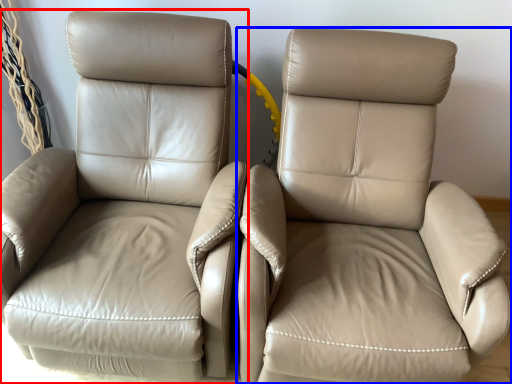
Question: Which point is further to the camera, chair (highlighted by a red box) or chair (highlighted by a blue box)?

Choices:
 (A) chair
 (B) chair

Answer: (A)